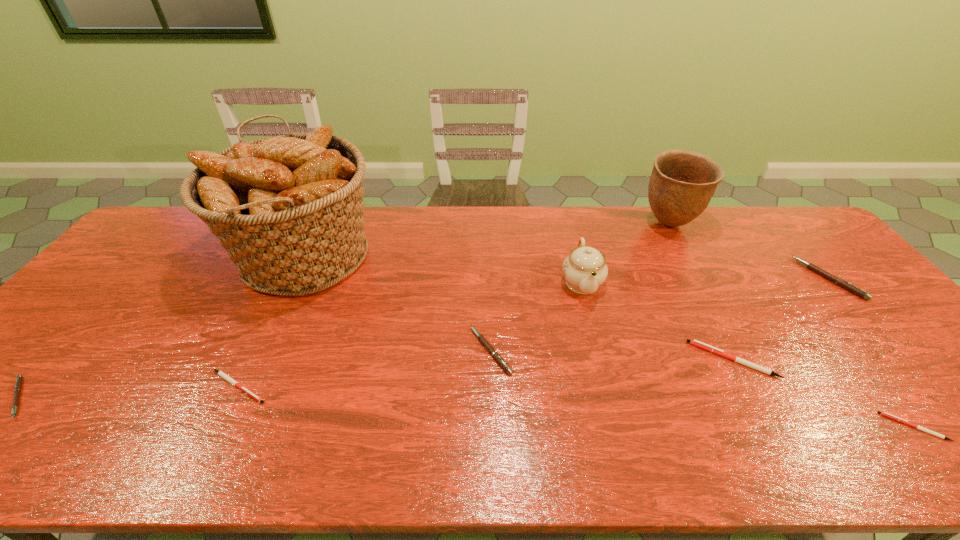
I want to click on the leftmost white pen, so click(220, 373).

Find the location of a particular element. This screenshot has width=960, height=540. the second pen from left to right is located at coordinates (220, 373).

Find the location of a particular element. The image size is (960, 540). the rightmost white pen is located at coordinates (885, 414).

This screenshot has height=540, width=960. I want to click on the nearest white pen, so click(885, 414).

Identify the location of vacant position located on the left of the basket. Image resolution: width=960 pixels, height=540 pixels. (161, 258).

In order to click on free space located 0.230m on the left of the second tallest object in this screenshot , I will do 571,224.

Image resolution: width=960 pixels, height=540 pixels. In order to click on free spot located 0.310m at the spout of the chinaware in this screenshot , I will do `click(612, 405)`.

Locate an element on the screen. free location located at the nib of the farthest pen is located at coordinates (749, 279).

Identify the location of free space located 0.380m at the nib of the farthest pen. (678, 279).

The height and width of the screenshot is (540, 960). What are the coordinates of `free region located at the nib of the farthest pen` in the screenshot? It's located at 678,279.